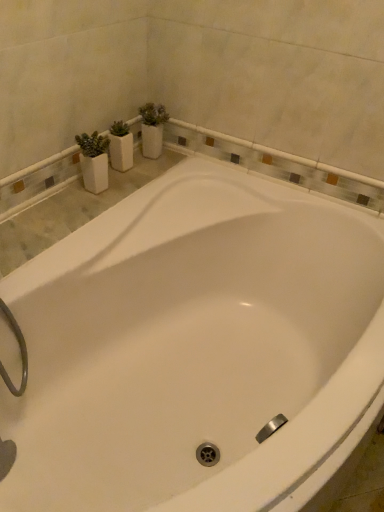
What do you see at coordinates (196, 348) in the screenshot?
I see `white glossy bathtub at upper center` at bounding box center [196, 348].

The height and width of the screenshot is (512, 384). In order to click on white glossy bathtub at upper center in this screenshot , I will do `click(196, 348)`.

Measure the distance between white glossy bathtub at upper center and camera.

They are 1.10 meters apart.

This screenshot has width=384, height=512. In order to click on white glossy bathtub at upper center in this screenshot , I will do `click(196, 348)`.